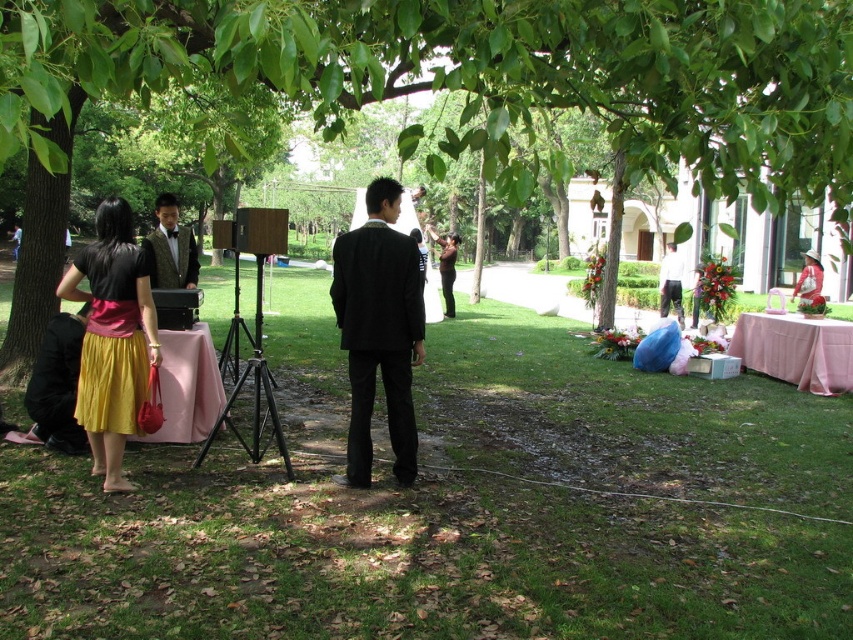
You are a photographer at the park and want to capture a clear photo of the white fabric dress at center without any obstruction. Given that the green leafy tree at center is above it, what should you do to ensure the dress is visible?

The green leafy tree at center is positioned over the white fabric dress at center, so you should move the camera equipment to a lower angle or position to avoid the tree blocking the view of the dress.

In the scene shown: What are the coordinates of the green leafy tree at center?

The green leafy tree at center is located at coordinates point [483,76].

You are a photographer trying to capture a portrait of the person in the shiny black vest at center without the green leafy tree at center blocking the background. Can you adjust your position to achieve this?

The green leafy tree at center is closer to the viewer than the shiny black vest at center, so adjusting your position might not help as the tree is in front of the vest. You may need to move the tree or the vest to avoid the obstruction.